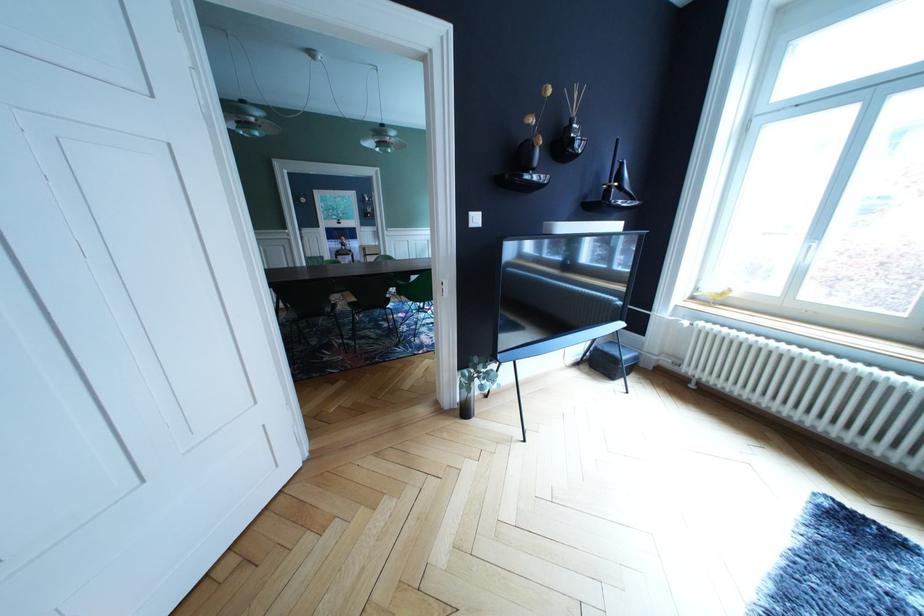
Find the location of `black decorative sculpture`. black decorative sculpture is located at coordinates (614, 188).